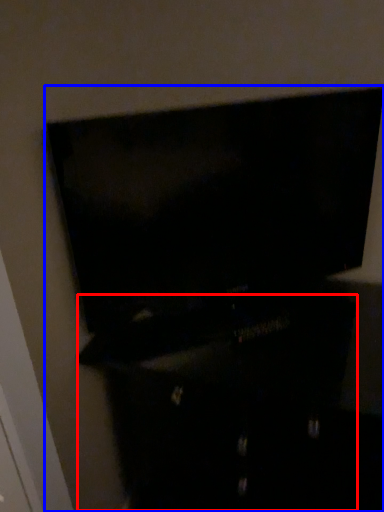
Question: Which object is closer to the camera taking this photo, dresser (highlighted by a red box) or furniture (highlighted by a blue box)?

Choices:
 (A) dresser
 (B) furniture

Answer: (B)